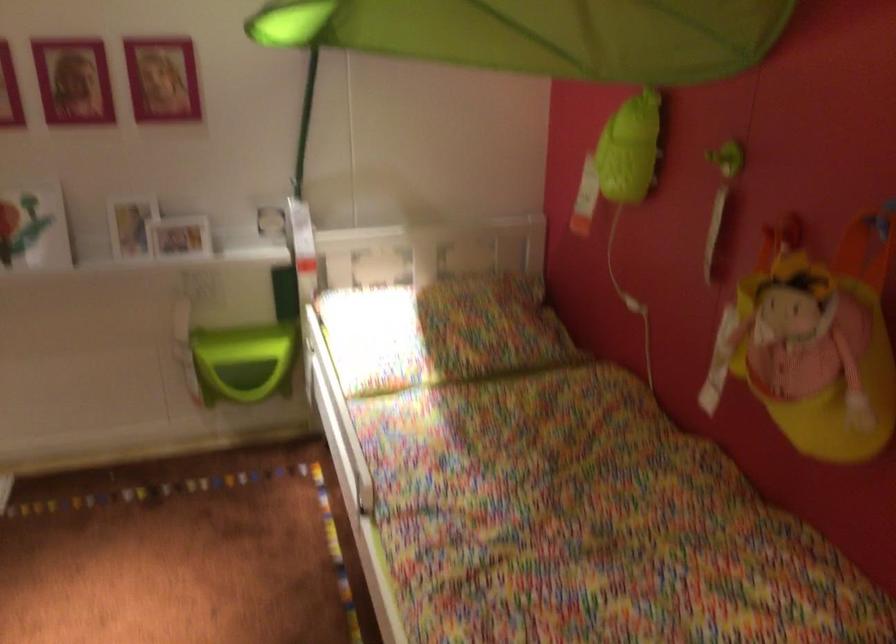
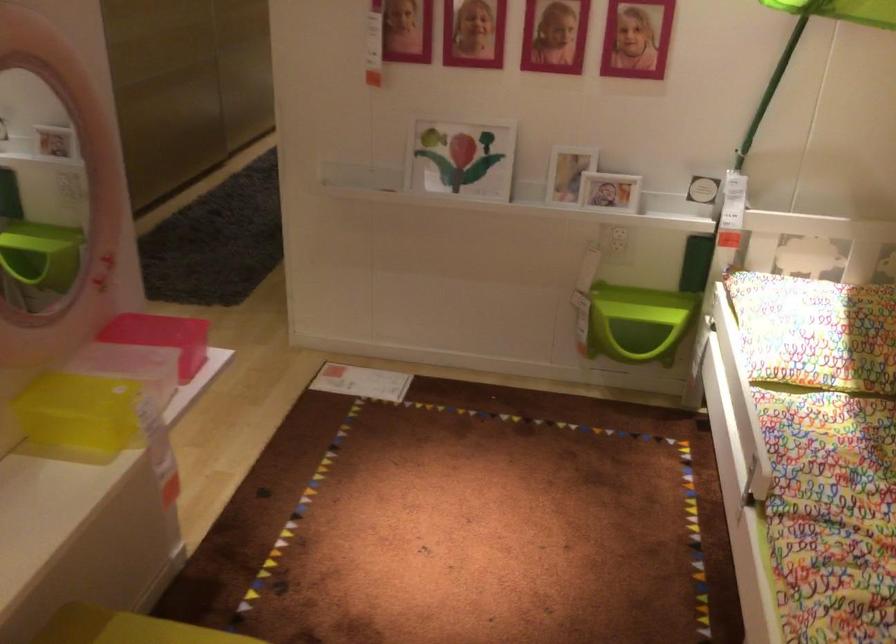
Question: What movement of the cameraman would produce the second image?

Choices:
 (A) Left
 (B) Right
 (C) Forward
 (D) Backward

Answer: (A)